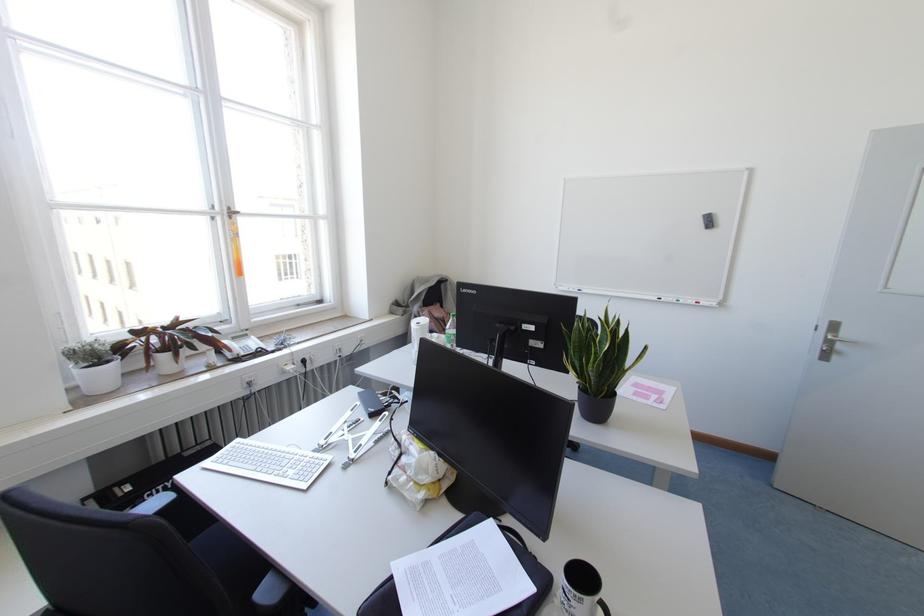
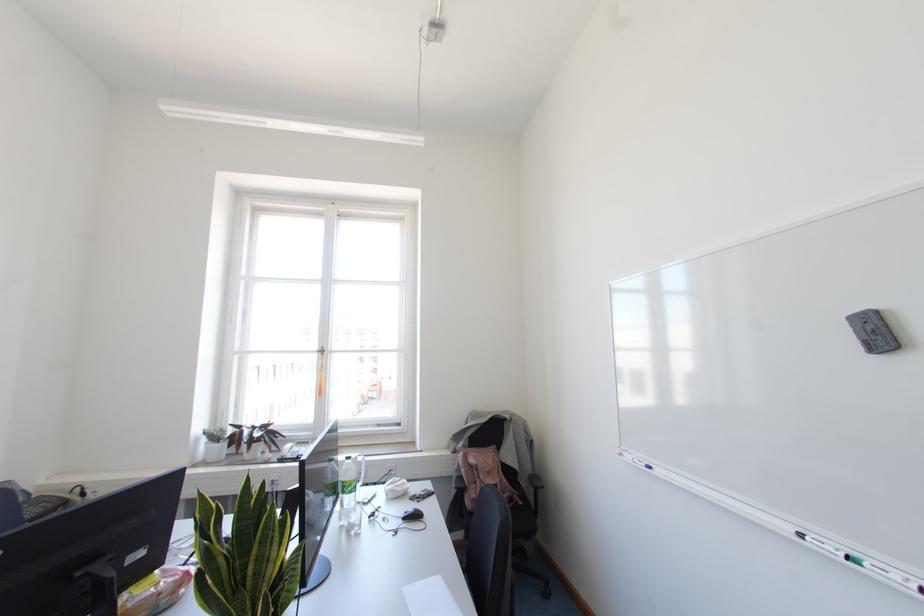
In the second image, find the point that corresponds to (679,301) in the first image.

(866, 565)